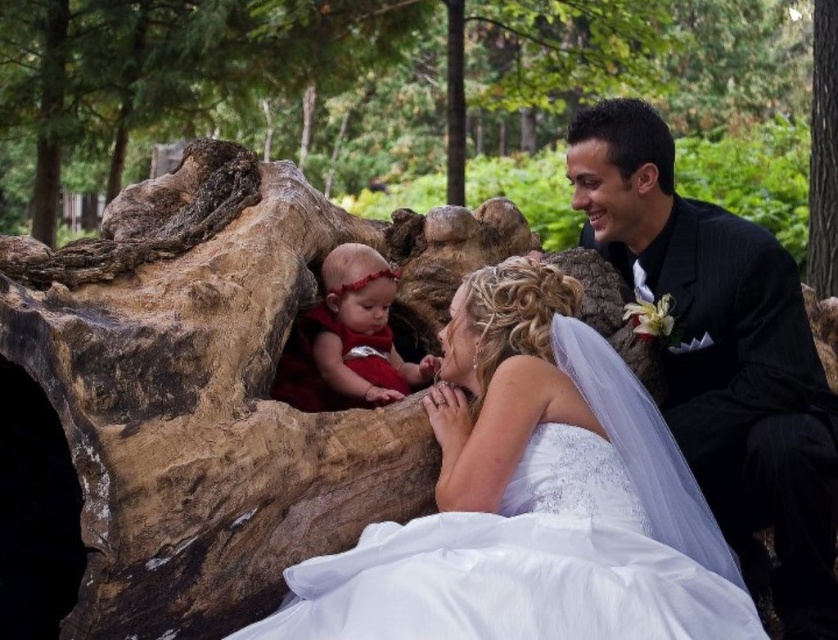
Consider the image. In the wedding scene, where exactly is the brown rough log at center located in terms of its 2D coordinates?

The brown rough log at center is located at the 2D coordinates of point (208, 81).

In the wedding scene, there is a black pinstripe suit at right and a brown rough tree trunk at right. From the perspective of someone facing the scene, which object is positioned to the left?

The black pinstripe suit at right is positioned to the left of the brown rough tree trunk at right.

You are a photographer standing at the camera position. You want to capture a closeup of the white lace dress at center. Given that your camera can focus on objects within 20 feet, will you be able to capture a clear closeup?

The white lace dress at center is 29.58 feet away from the camera, which is beyond the 20 feet focusing range. Therefore, the camera cannot capture a clear closeup of the white lace dress at center.